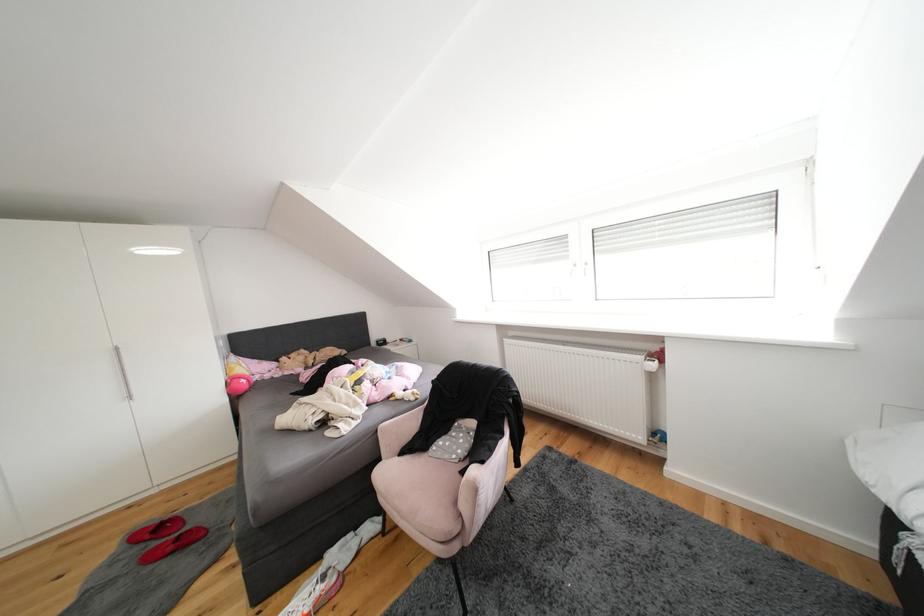
The location [377,379] corresponds to which object?

This point indicates the pink plush toy.